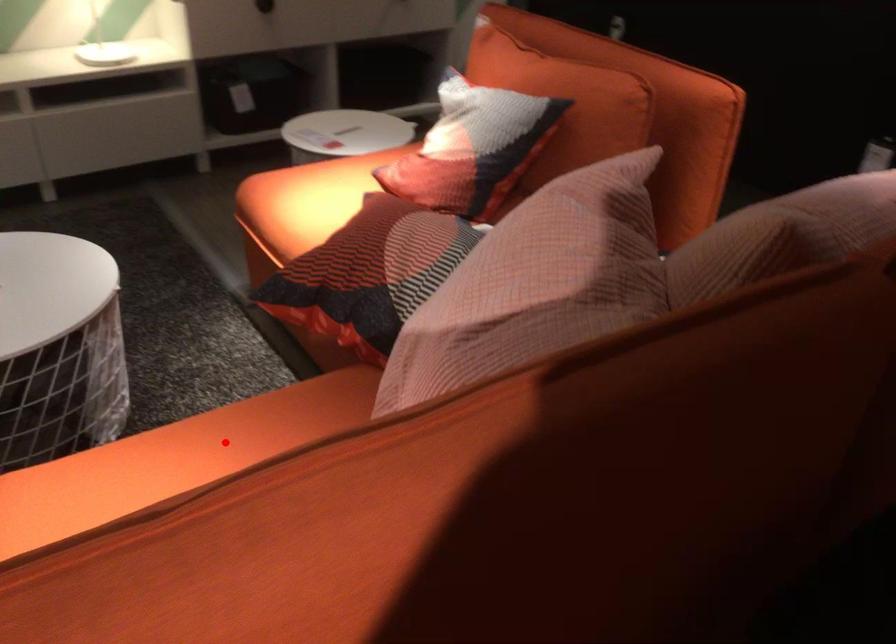
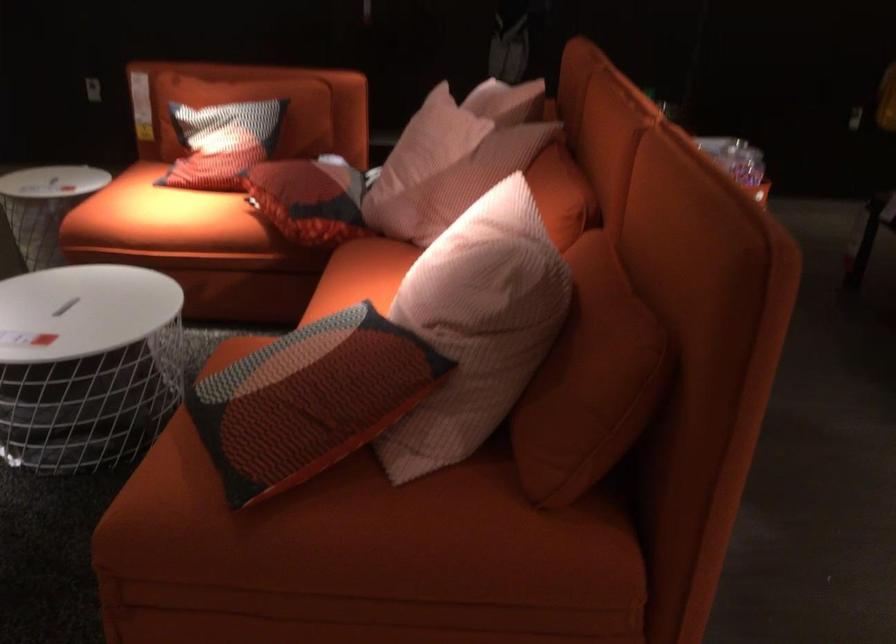
Question: I am providing you with two images of the same scene from different viewpoints. Image1 has a red point marked. In image2, the corresponding 3D location appears at what relative position? Reply with the corresponding letter.

Choices:
 (A) Closer
 (B) Farther

Answer: (B)